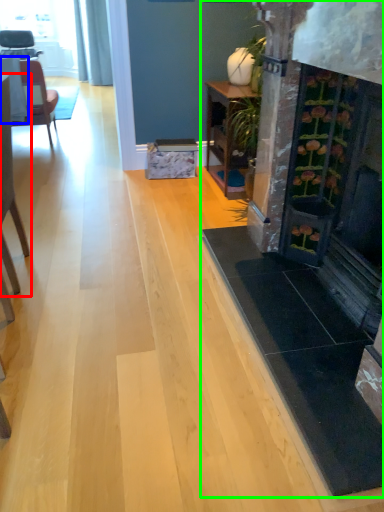
Question: Which object is the farthest from chair (highlighted by a red box)? Choose among these: table (highlighted by a blue box) or fireplace (highlighted by a green box).

Choices:
 (A) table
 (B) fireplace

Answer: (A)